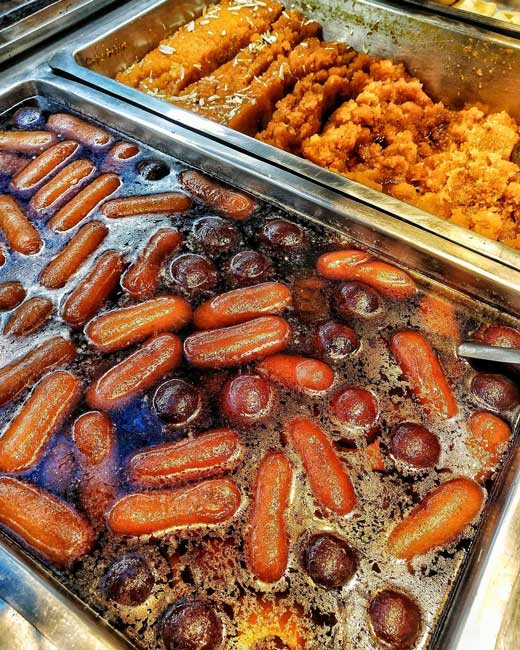
Find the location of a particular element. The image size is (520, 650). buffet is located at coordinates (506, 610).